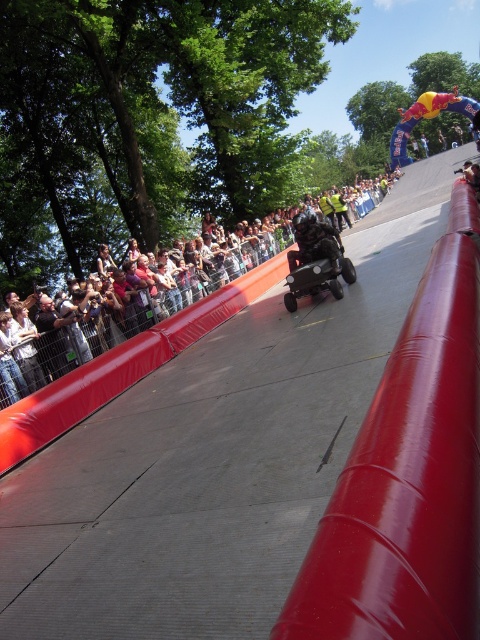
Question: Is smooth rubber rail at center right behind matte black crowd at left?

Choices:
 (A) no
 (B) yes

Answer: (A)

Question: Can you confirm if smooth rubber rail at center right is positioned below matte black crowd at left?

Choices:
 (A) no
 (B) yes

Answer: (B)

Question: Which point appears farthest from the camera in this image?

Choices:
 (A) (32, 392)
 (B) (372, 500)

Answer: (A)

Question: Does smooth rubber rail at center right appear under matte black crowd at left?

Choices:
 (A) no
 (B) yes

Answer: (B)